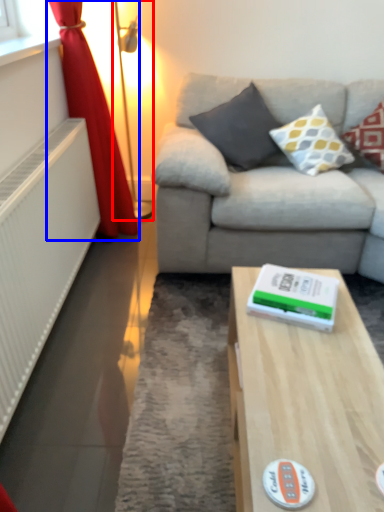
Question: Which point is closer to the camera, table lamp (highlighted by a red box) or curtain (highlighted by a blue box)?

Choices:
 (A) table lamp
 (B) curtain

Answer: (B)